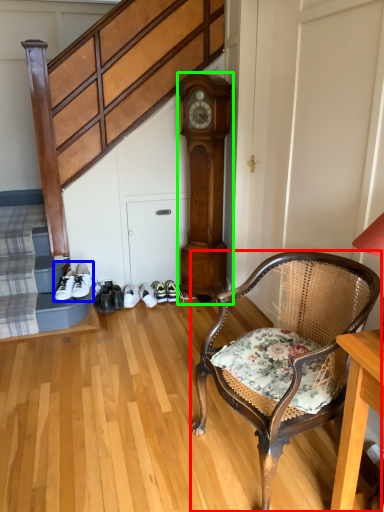
Question: Estimate the real-world distances between objects in this image. Which object is farther from chair (highlighted by a red box), footwear (highlighted by a blue box) or clock (highlighted by a green box)?

Choices:
 (A) footwear
 (B) clock

Answer: (A)